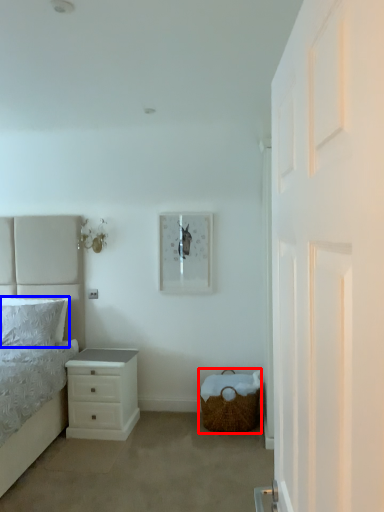
Question: Among these objects, which one is farthest to the camera, basket (highlighted by a red box) or pillow (highlighted by a blue box)?

Choices:
 (A) basket
 (B) pillow

Answer: (B)